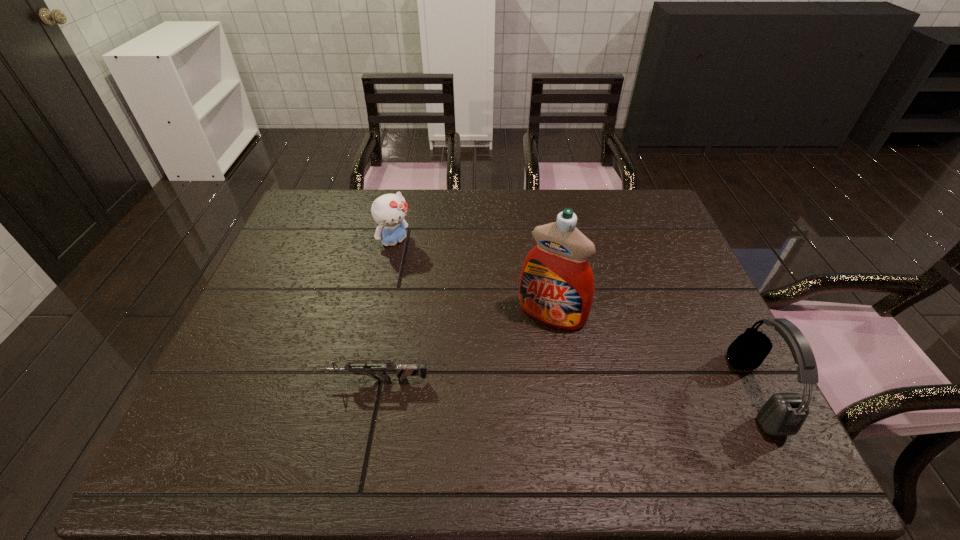
Locate an element on the screen. The height and width of the screenshot is (540, 960). free location located on the front-facing side of the second shortest object is located at coordinates (474, 320).

Identify the location of vacant space situated 0.270m on the front-facing side of the second shortest object. (458, 304).

This screenshot has height=540, width=960. Find the location of `vacant space situated 0.180m on the front-facing side of the second shortest object`. vacant space situated 0.180m on the front-facing side of the second shortest object is located at coordinates (440, 285).

This screenshot has height=540, width=960. I want to click on free space located 0.240m on the front surface of the detergent, so click(494, 405).

At what (x,y) coordinates should I click in order to perform the action: click on free space located 0.100m on the front surface of the detergent. Please return your answer as a coordinate pair (x, y). Looking at the image, I should click on (521, 359).

Identify the location of free region located on the front surface of the detergent. The height and width of the screenshot is (540, 960). (496, 401).

You are a GUI agent. You are given a task and a screenshot of the screen. Output one action in this format:
    pyautogui.click(x=<x>, y=<y>)
    Task: Click on the object present at the far edge
    The width and height of the screenshot is (960, 540).
    Given the screenshot: What is the action you would take?
    pyautogui.click(x=389, y=211)

Identify the location of gun that is at the near edge. This screenshot has height=540, width=960. (402, 371).

Locate an element on the screen. This screenshot has height=540, width=960. headset that is at the near edge is located at coordinates (783, 414).

The height and width of the screenshot is (540, 960). In order to click on object at the right edge in this screenshot , I will do `click(783, 414)`.